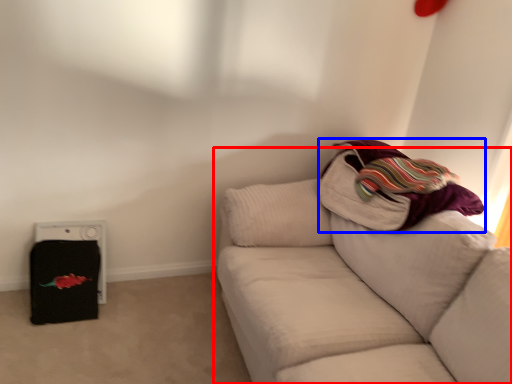
Question: Which point is further to the camera, studio couch (highlighted by a red box) or blanket (highlighted by a blue box)?

Choices:
 (A) studio couch
 (B) blanket

Answer: (B)